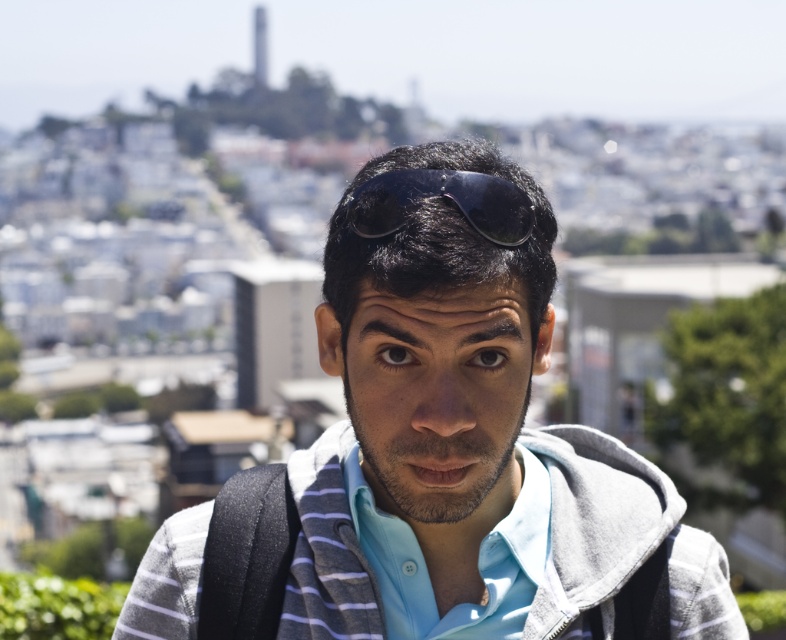
Question: Is light blue cotton shirt at center further to the viewer compared to black glossy sunglasses at center?

Choices:
 (A) no
 (B) yes

Answer: (B)

Question: Does gray fleece sweatshirt at center have a smaller size compared to black glossy sunglasses at center?

Choices:
 (A) no
 (B) yes

Answer: (A)

Question: Which is farther from the gray cotton hoodie at center?

Choices:
 (A) black glossy sunglasses at center
 (B) light blue cotton shirt at center

Answer: (B)

Question: Which object is positioned farthest from the light blue cotton shirt at center?

Choices:
 (A) gray cotton hoodie at center
 (B) black glossy sunglasses at center
 (C) gray fleece sweatshirt at center

Answer: (B)

Question: Based on their relative distances, which object is farther from the gray cotton hoodie at center?

Choices:
 (A) black glossy sunglasses at center
 (B) gray fleece sweatshirt at center
 (C) light blue cotton shirt at center

Answer: (C)

Question: Does light blue cotton shirt at center appear under black glossy sunglasses at center?

Choices:
 (A) yes
 (B) no

Answer: (A)